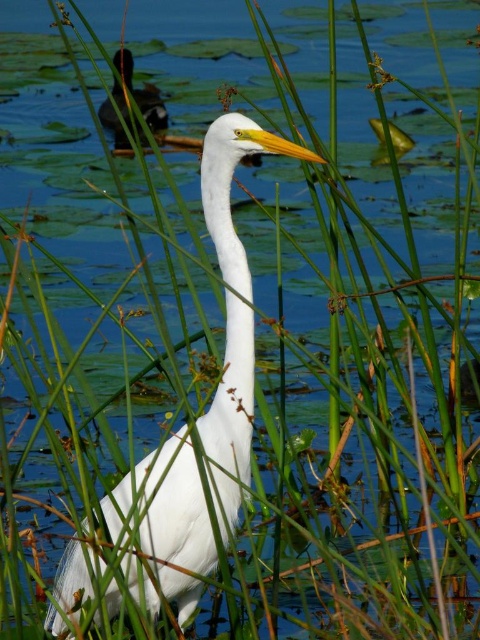
Question: Among these points, which one is farthest from the camera?

Choices:
 (A) (128, 67)
 (B) (249, 129)

Answer: (A)

Question: Which point appears closest to the camera in this image?

Choices:
 (A) (154, 99)
 (B) (248, 467)

Answer: (B)

Question: Can you confirm if white matte bird at center is positioned to the left of shiny black duck at upper left?

Choices:
 (A) no
 (B) yes

Answer: (A)

Question: Where is white matte bird at center located in relation to shiny black duck at upper left in the image?

Choices:
 (A) below
 (B) above

Answer: (A)

Question: Which point is closer to the camera taking this photo?

Choices:
 (A) (239, 376)
 (B) (156, 104)

Answer: (A)

Question: Is white matte bird at center closer to camera compared to shiny black duck at upper left?

Choices:
 (A) yes
 (B) no

Answer: (A)